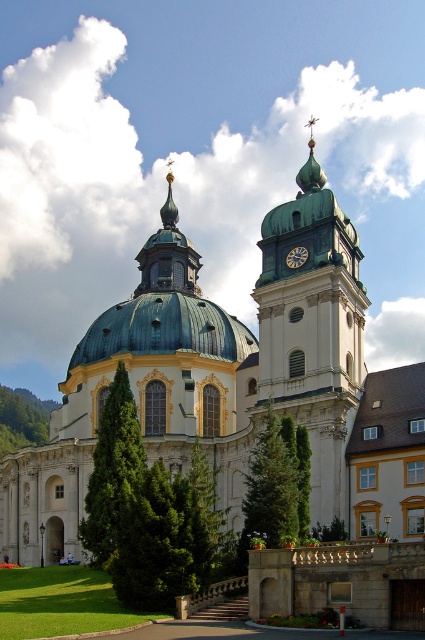
Question: Which point is farther to the camera?

Choices:
 (A) (345, 349)
 (B) (305, 259)

Answer: (B)

Question: Which point is farther to the camera?

Choices:
 (A) (334, 246)
 (B) (295, 268)
 (C) (184, 346)

Answer: (C)

Question: Can you confirm if green dome at center is thinner than gold metallic clock at center?

Choices:
 (A) no
 (B) yes

Answer: (A)

Question: Does green dome at center have a lesser width compared to gold metallic clock at center?

Choices:
 (A) no
 (B) yes

Answer: (A)

Question: Can you confirm if green copper bell tower at center is bigger than gold metallic clock at center?

Choices:
 (A) yes
 (B) no

Answer: (A)

Question: Which point is closer to the camera?

Choices:
 (A) (337, 429)
 (B) (85, 428)

Answer: (A)